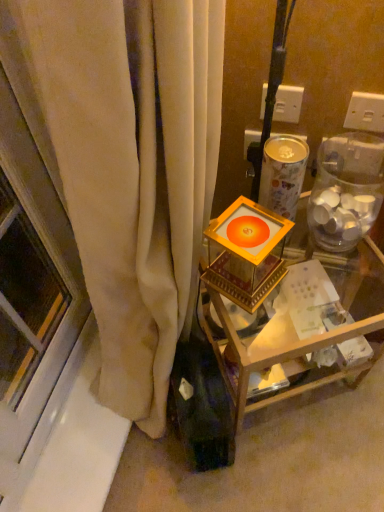
Question: Is transparent plastic jar at right at the right side of white plastic electric outlet at upper center, arranged as the second electric outlet when viewed from the left?

Choices:
 (A) yes
 (B) no

Answer: (B)

Question: Is the depth of transparent plastic jar at right less than that of white plastic electric outlet at upper center, placed as the 1th electric outlet when sorted from right to left?

Choices:
 (A) no
 (B) yes

Answer: (B)

Question: Would you say white plastic electric outlet at upper center, arranged as the second electric outlet when viewed from the left, is part of transparent plastic jar at right's contents?

Choices:
 (A) no
 (B) yes

Answer: (A)

Question: Are transparent plastic jar at right and white plastic electric outlet at upper center, placed as the 1th electric outlet when sorted from right to left, beside each other?

Choices:
 (A) no
 (B) yes

Answer: (A)

Question: Can you confirm if transparent plastic jar at right is wider than white plastic electric outlet at upper center, placed as the 1th electric outlet when sorted from right to left?

Choices:
 (A) yes
 (B) no

Answer: (A)

Question: From a real-world perspective, is gold metallic candle holder at center positioned above or below gold metallic frame at center?

Choices:
 (A) above
 (B) below

Answer: (A)

Question: Is gold metallic candle holder at center in front of or behind gold metallic frame at center in the image?

Choices:
 (A) front
 (B) behind

Answer: (A)

Question: Is gold metallic candle holder at center taller or shorter than gold metallic frame at center?

Choices:
 (A) short
 (B) tall

Answer: (A)

Question: Is gold metallic candle holder at center inside or outside of gold metallic frame at center?

Choices:
 (A) outside
 (B) inside

Answer: (A)

Question: Would you say white plastic electric outlet at upper center, arranged as the second electric outlet when viewed from the left, is to the left or to the right of gold metallic frame at center in the picture?

Choices:
 (A) left
 (B) right

Answer: (B)

Question: In terms of width, does white plastic electric outlet at upper center, arranged as the second electric outlet when viewed from the left, look wider or thinner when compared to gold metallic frame at center?

Choices:
 (A) wide
 (B) thin

Answer: (B)

Question: In terms of height, does white plastic electric outlet at upper center, placed as the 1th electric outlet when sorted from right to left, look taller or shorter compared to gold metallic frame at center?

Choices:
 (A) tall
 (B) short

Answer: (B)

Question: From the image's perspective, is white plastic electric outlet at upper center, arranged as the second electric outlet when viewed from the left, located above or below gold metallic frame at center?

Choices:
 (A) below
 (B) above

Answer: (B)

Question: From a real-world perspective, relative to white plastic electric outlet at upper center, placed as the 1th electric outlet when sorted from right to left, is white plastic electric outlet at upper right, placed as the 2th electric outlet when sorted from right to left, vertically above or below?

Choices:
 (A) above
 (B) below

Answer: (B)

Question: Would you say white plastic electric outlet at upper right, placed as the 2th electric outlet when sorted from right to left, is to the left or to the right of white plastic electric outlet at upper center, placed as the 1th electric outlet when sorted from right to left, in the picture?

Choices:
 (A) left
 (B) right

Answer: (A)